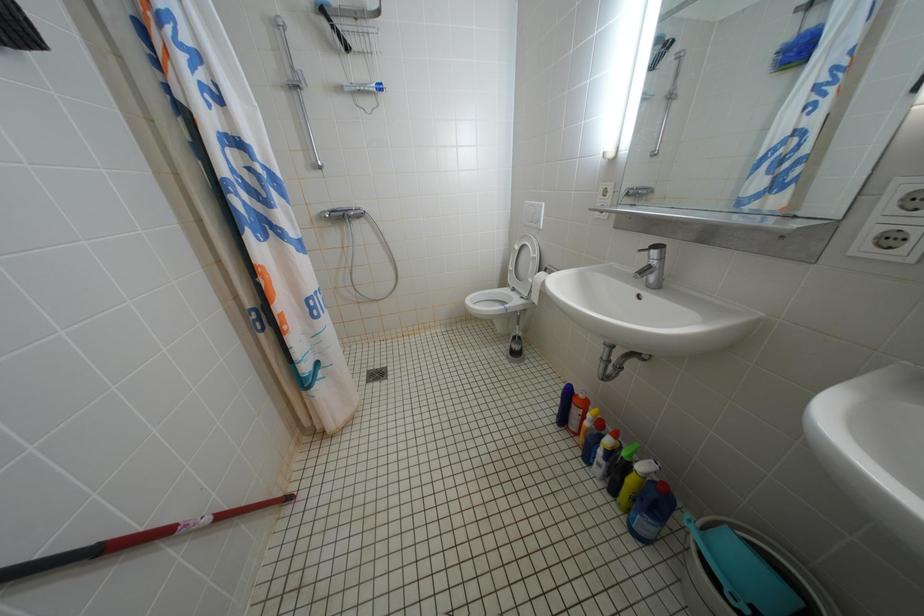
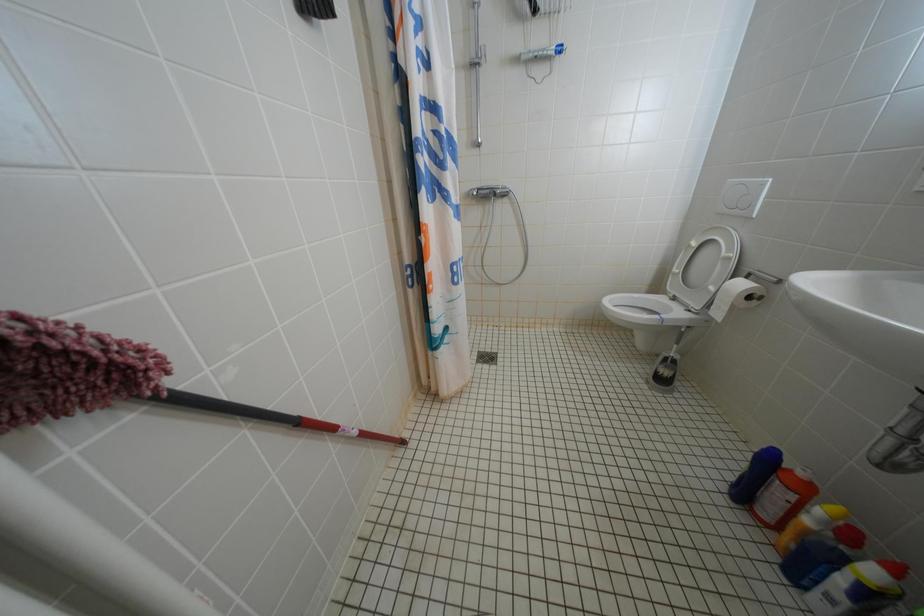
Which direction would the cameraman need to move to produce the second image?

The cameraman walked toward left, forward.